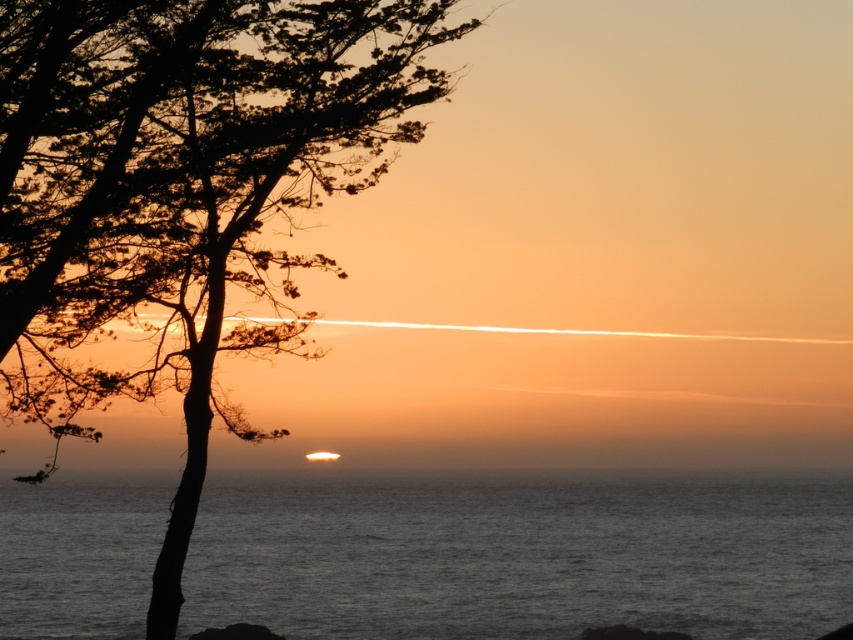
Question: Is silhouette bark tree at left below dark gray water at center?

Choices:
 (A) no
 (B) yes

Answer: (A)

Question: Among these objects, which one is nearest to the camera?

Choices:
 (A) silhouette bark tree at left
 (B) dark gray water at center

Answer: (A)

Question: Considering the relative positions of silhouette bark tree at left and dark gray water at center in the image provided, where is silhouette bark tree at left located with respect to dark gray water at center?

Choices:
 (A) below
 (B) above

Answer: (B)

Question: From the image, what is the correct spatial relationship of silhouette bark tree at left in relation to dark gray water at center?

Choices:
 (A) right
 (B) left

Answer: (A)

Question: Which of the following is the closest to the observer?

Choices:
 (A) silhouette bark tree at left
 (B) dark gray water at center

Answer: (A)